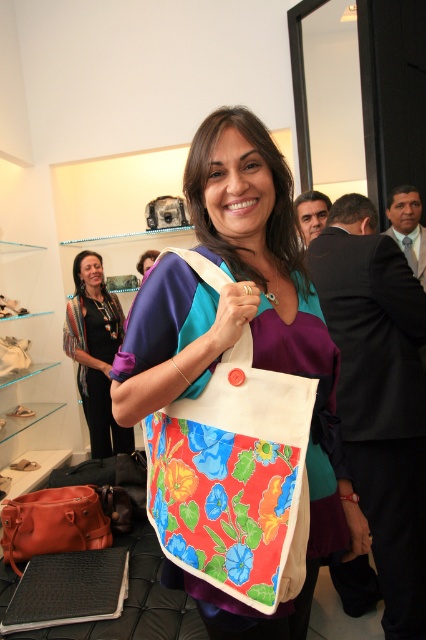
Can you confirm if floral fabric bag at center is thinner than leather handbag at center?

In fact, floral fabric bag at center might be wider than leather handbag at center.

Which is behind, point (215, 196) or point (19, 509)?

Positioned behind is point (19, 509).

Does point (259, 176) lie in front of point (52, 547)?

Yes, it is in front of point (52, 547).

Find the location of `floral fabric bag at center`. floral fabric bag at center is located at coordinates (238, 337).

Is striped fabric dress at left shorter than leather handbag at center?

In fact, striped fabric dress at left may be taller than leather handbag at center.

Which is behind, point (115, 449) or point (57, 492)?

The point (115, 449) is behind.

Between point (120, 444) and point (40, 524), which one is positioned behind?

The point (120, 444) is behind.

The image size is (426, 640). Find the location of `striped fabric dress at left`. striped fabric dress at left is located at coordinates (94, 353).

Between floral fabric bag at center and striped fabric dress at left, which one appears on the left side from the viewer's perspective?

striped fabric dress at left

Does floral fabric bag at center have a greater width compared to striped fabric dress at left?

Yes, floral fabric bag at center is wider than striped fabric dress at left.

Does point (132, 403) lie in front of point (97, 401)?

Yes.

Find the location of a particular element. floral fabric bag at center is located at coordinates pos(238,337).